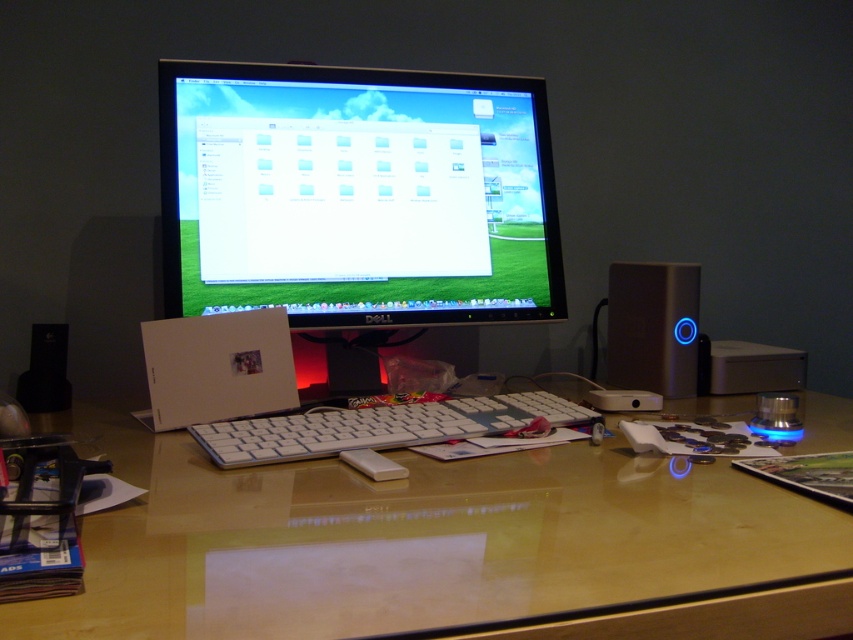
Question: Can you confirm if glossy wood computer desk at center is positioned to the right of white plastic keyboard at center?

Choices:
 (A) no
 (B) yes

Answer: (B)

Question: Among these objects, which one is farthest from the camera?

Choices:
 (A) satin silver speaker at right
 (B) glossy wood computer desk at center

Answer: (A)

Question: Does white plastic monitor at center appear on the right side of white plastic keyboard at center?

Choices:
 (A) no
 (B) yes

Answer: (A)

Question: Which object appears closest to the camera in this image?

Choices:
 (A) glossy wood computer desk at center
 (B) satin silver speaker at right
 (C) white plastic keyboard at center

Answer: (A)

Question: Which point appears farthest from the camera in this image?

Choices:
 (A) (200, 621)
 (B) (665, 285)
 (C) (393, 237)

Answer: (B)

Question: Is white plastic monitor at center closer to the viewer compared to satin silver speaker at right?

Choices:
 (A) yes
 (B) no

Answer: (A)